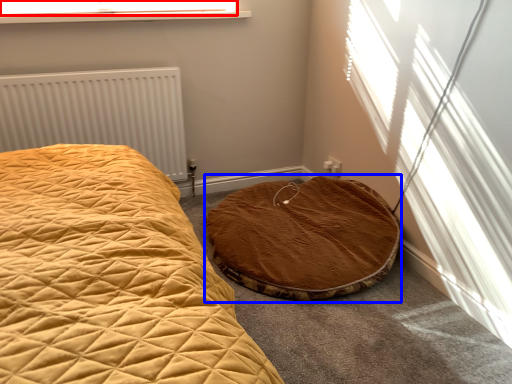
Question: Which of the following is the farthest to the observer, window screen (highlighted by a red box) or cat bed (highlighted by a blue box)?

Choices:
 (A) window screen
 (B) cat bed

Answer: (A)